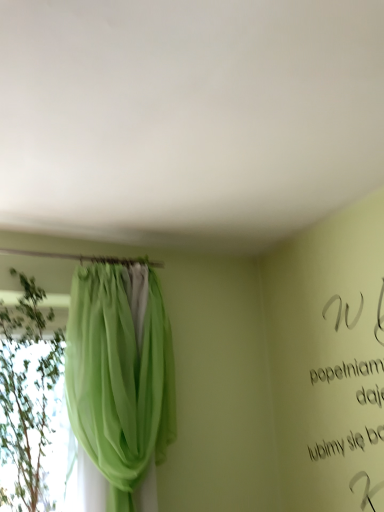
What do you see at coordinates (120, 377) in the screenshot?
I see `green sheer curtain at left` at bounding box center [120, 377].

Where is `green sheer curtain at left`? Image resolution: width=384 pixels, height=512 pixels. green sheer curtain at left is located at coordinates (120, 377).

At what (x,y) coordinates should I click in order to perform the action: click on green sheer curtain at left. Please return your answer as a coordinate pair (x, y). Looking at the image, I should click on (27, 395).

What do you see at coordinates (27, 395) in the screenshot? I see `green sheer curtain at left` at bounding box center [27, 395].

What are the coordinates of `green sheer curtain at left` in the screenshot? It's located at (120, 377).

Does green sheer curtain at left appear on the right side of green sheer curtain at left?

No.

Looking at this image, does green sheer curtain at left come in front of green sheer curtain at left?

No, green sheer curtain at left is behind green sheer curtain at left.

Which is nearer, (x=3, y=498) or (x=146, y=420)?

Point (x=146, y=420)

From the image's perspective, between green sheer curtain at left and green sheer curtain at left, who is located below?

From the image's view, green sheer curtain at left is below.

From a real-world perspective, between green sheer curtain at left and green sheer curtain at left, who is vertically higher?

In real-world perspective, green sheer curtain at left is above.

Is green sheer curtain at left wider than green sheer curtain at left?

Correct, the width of green sheer curtain at left exceeds that of green sheer curtain at left.

Is green sheer curtain at left taller or shorter than green sheer curtain at left?

green sheer curtain at left is shorter than green sheer curtain at left.

Who is smaller, green sheer curtain at left or green sheer curtain at left?

green sheer curtain at left.

Which is correct: green sheer curtain at left is inside green sheer curtain at left, or outside of it?

green sheer curtain at left is outside green sheer curtain at left.

Is green sheer curtain at left beside green sheer curtain at left?

No, green sheer curtain at left is not touching green sheer curtain at left.

Is green sheer curtain at left looking in the opposite direction of green sheer curtain at left?

No, green sheer curtain at left is not at the back of green sheer curtain at left.

In the image, there is a green sheer curtain at left. Identify the location of plant below it (from a real-world perspective). (27, 395).

Between green sheer curtain at left and green sheer curtain at left, which one appears on the left side from the viewer's perspective?

From the viewer's perspective, green sheer curtain at left appears more on the left side.

Which object is closer to the camera taking this photo, green sheer curtain at left or green sheer curtain at left?

green sheer curtain at left is closer to the camera.

Looking at this image, which is farther from the camera, [106,367] or [30,365]?

The point [30,365] is farther from the camera.

From the image's perspective, is green sheer curtain at left positioned above or below green sheer curtain at left?

green sheer curtain at left is above green sheer curtain at left.

From a real-world perspective, is green sheer curtain at left located higher than green sheer curtain at left?

Yes, from a real-world perspective, green sheer curtain at left is above green sheer curtain at left.

Can you confirm if green sheer curtain at left is thinner than green sheer curtain at left?

Yes.

Consider the image. In terms of height, does green sheer curtain at left look taller or shorter compared to green sheer curtain at left?

Clearly, green sheer curtain at left is taller compared to green sheer curtain at left.

Is green sheer curtain at left smaller than green sheer curtain at left?

No, green sheer curtain at left is not smaller than green sheer curtain at left.

Is green sheer curtain at left not inside green sheer curtain at left?

Yes, green sheer curtain at left is outside of green sheer curtain at left.

Is green sheer curtain at left far from green sheer curtain at left?

No, there isn't a large distance between green sheer curtain at left and green sheer curtain at left.

Consider the image. Is green sheer curtain at left oriented towards green sheer curtain at left?

No, green sheer curtain at left is not turned towards green sheer curtain at left.

How many degrees apart are the facing directions of green sheer curtain at left and green sheer curtain at left?

The angle between the facing direction of green sheer curtain at left and the facing direction of green sheer curtain at left is 4.32 degrees.

Locate an element on the screen. The height and width of the screenshot is (512, 384). curtain in front of the green sheer curtain at left is located at coordinates (120, 377).

Identify the location of plant on the left of green sheer curtain at left. (27, 395).

Find the location of a particular element. Image resolution: width=384 pixels, height=512 pixels. plant behind the green sheer curtain at left is located at coordinates (27, 395).